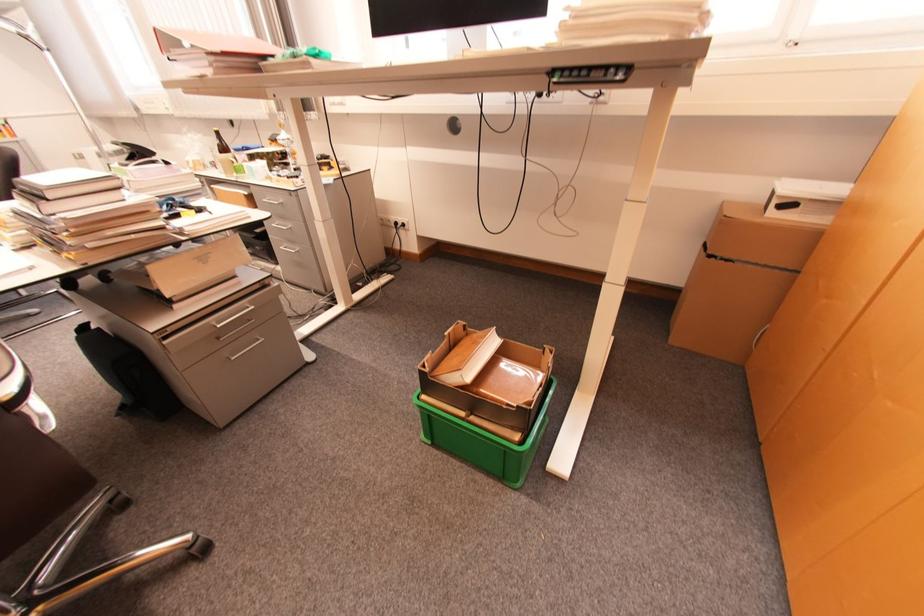
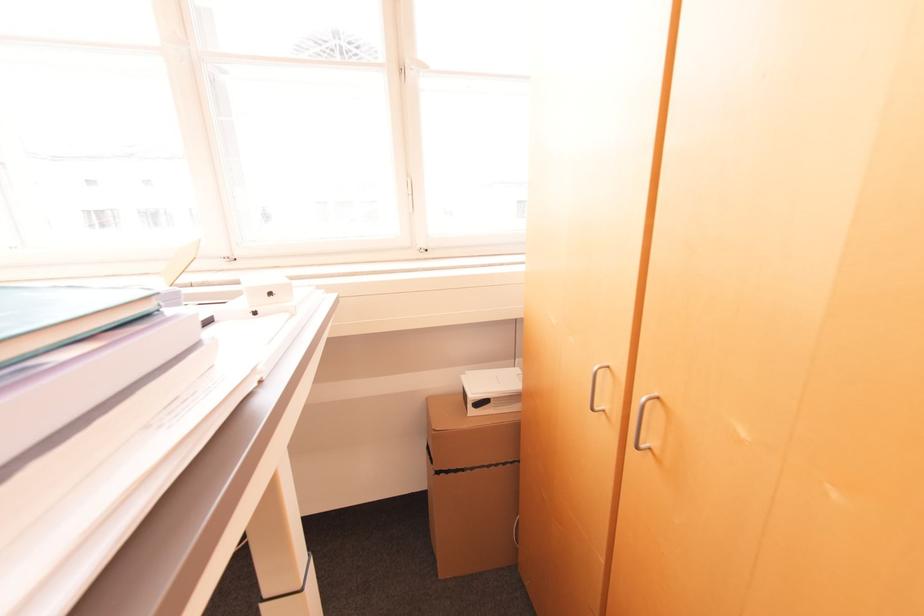
Question: How did the camera likely rotate?

Choices:
 (A) Left
 (B) Right
 (C) Up
 (D) Down

Answer: (B)